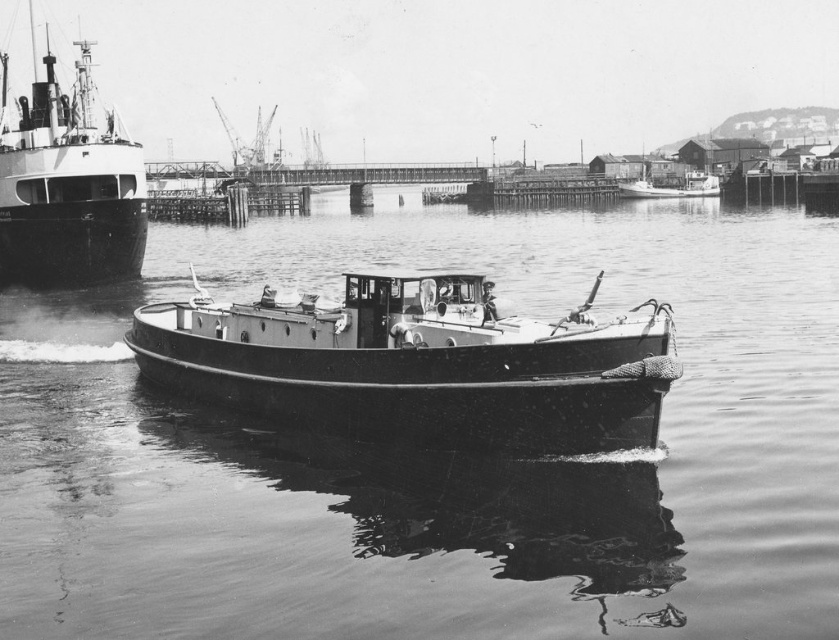
You are a sailor trying to navigate your boat through the harbor. You see the smooth water at center and the shiny black ship at left. Which object is located directly above the other?

The shiny black ship at left is positioned above the smooth water at center according to the description.

You are a photographer standing at the edge of the harbor. You want to capture a closeup shot of the smooth water at center. Given that your camera can focus on objects within 25 meters, will you be able to take the photo without moving closer?

The smooth water at center is 26.86 meters away from the camera, which is beyond the camera focus range of 25 meters. Therefore, you won measurements to take the photo without moving closer.

You are a photographer trying to capture the smooth wooden boat at center and the smooth water at center in a single shot. Based on the scene, which object appears larger in the photograph?

The smooth water at center appears larger because it is much taller than the smooth wooden boat at center.